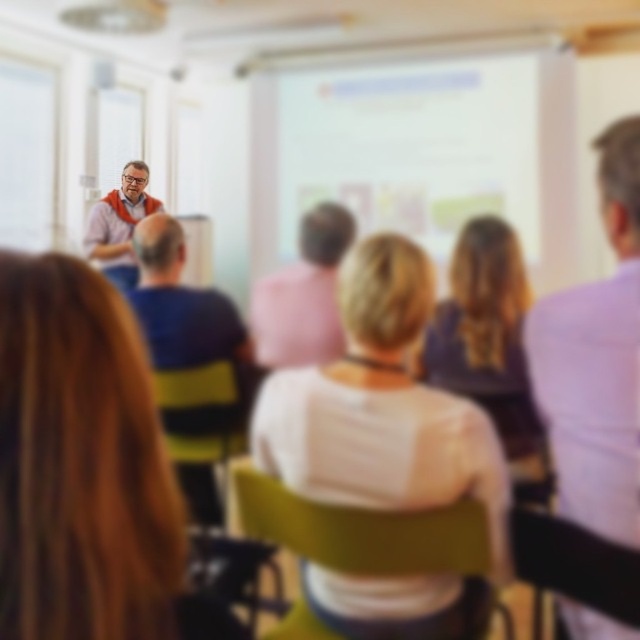
Is white matte shirt at center bigger than wooden chair at lower right?

Yes, white matte shirt at center is bigger than wooden chair at lower right.

Who is taller, white matte shirt at center or wooden chair at lower right?

Standing taller between the two is white matte shirt at center.

Who is more forward, (369, 269) or (612, 609)?

Point (612, 609)

The image size is (640, 640). Find the location of `white matte shirt at center`. white matte shirt at center is located at coordinates (381, 406).

Is light purple shirt at right behind orange fabric at upper left?

No, light purple shirt at right is closer to the viewer.

Who is taller, light purple shirt at right or orange fabric at upper left?

Standing taller between the two is light purple shirt at right.

Which is in front, point (604, 634) or point (113, 208)?

Positioned in front is point (604, 634).

The height and width of the screenshot is (640, 640). Find the location of `light purple shirt at right`. light purple shirt at right is located at coordinates (596, 360).

Is wooden chair at lower right wider than orange fabric at upper left?

No.

How far apart are wooden chair at lower right and orange fabric at upper left?

3.66 meters

Does point (596, 576) lie behind point (120, 189)?

No.

This screenshot has height=640, width=640. In order to click on wooden chair at lower right in this screenshot , I will do `click(576, 563)`.